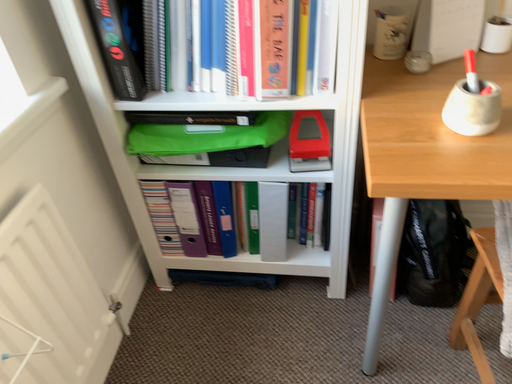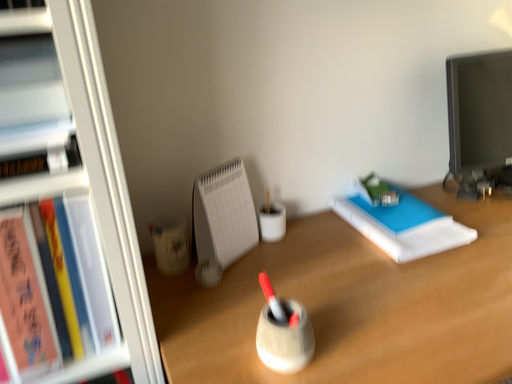
Question: Which way did the camera rotate in the video?

Choices:
 (A) rotated right
 (B) rotated left

Answer: (A)